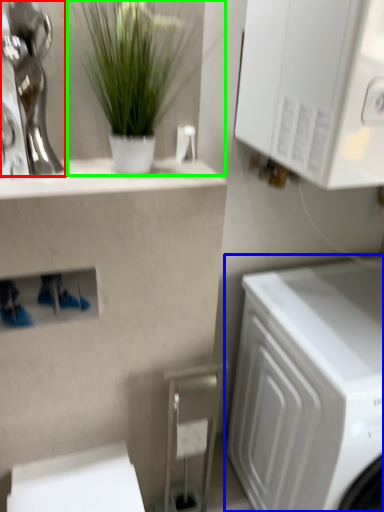
Question: Considering the real-world distances, which object is closest to statue (highlighted by a red box)? washing machine (highlighted by a blue box) or houseplant (highlighted by a green box).

Choices:
 (A) washing machine
 (B) houseplant

Answer: (B)